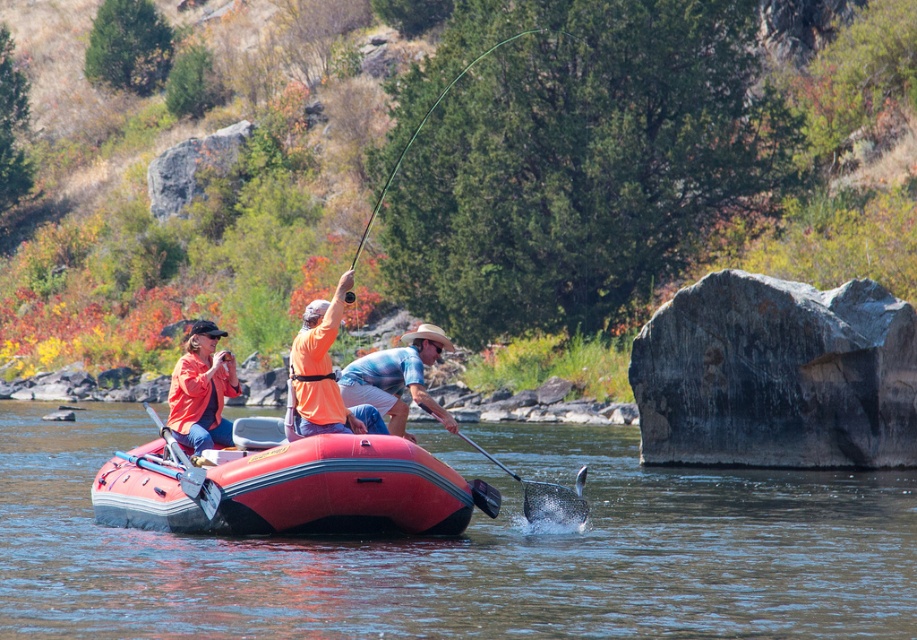
From the picture: You are standing at point A, which is at coordinates point (174,413), and you want to walk to point B, which is at coordinates point (526,435). Given the scene described, will you have to walk around any obstacles between these two points?

Yes, you will have to walk around the central figure holding a fishing rod high above their head, as point (526,435) is behind point (174,413) and the central figure is positioned between them.

You are planning to board the rubberized red raft at center for a short trip. However, you need to locate the orange matte life vest at center first. Based on the scene description, where should you look relative to the raft to find the life vest?

The orange matte life vest at center is to the right of the rubberized red raft at center.

What object is located at the coordinates point [466,550] in the scene?

The smooth rubber raft at center is located at the coordinates point [466,550].